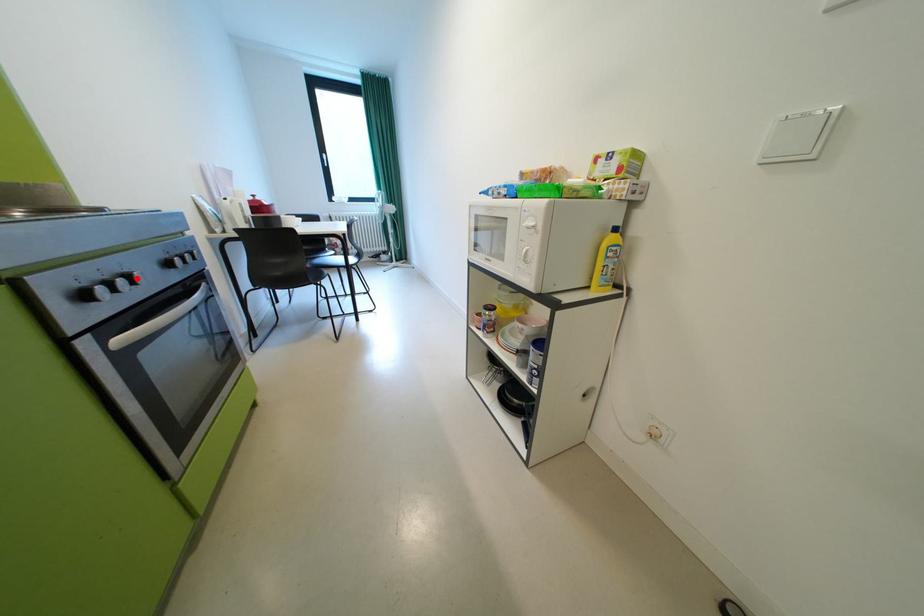
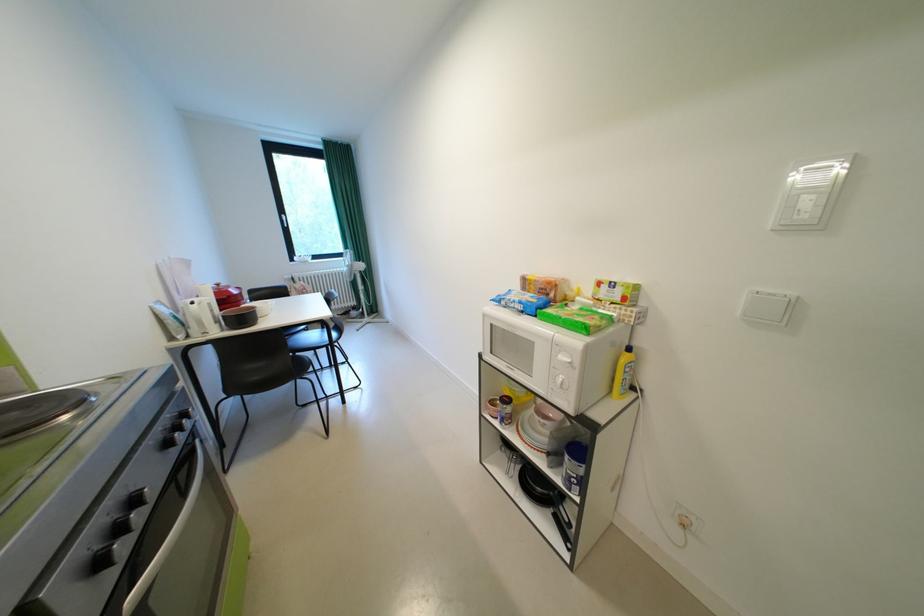
Where in the second image is the point corresponding to the highlighted location from the first image?

(146, 501)